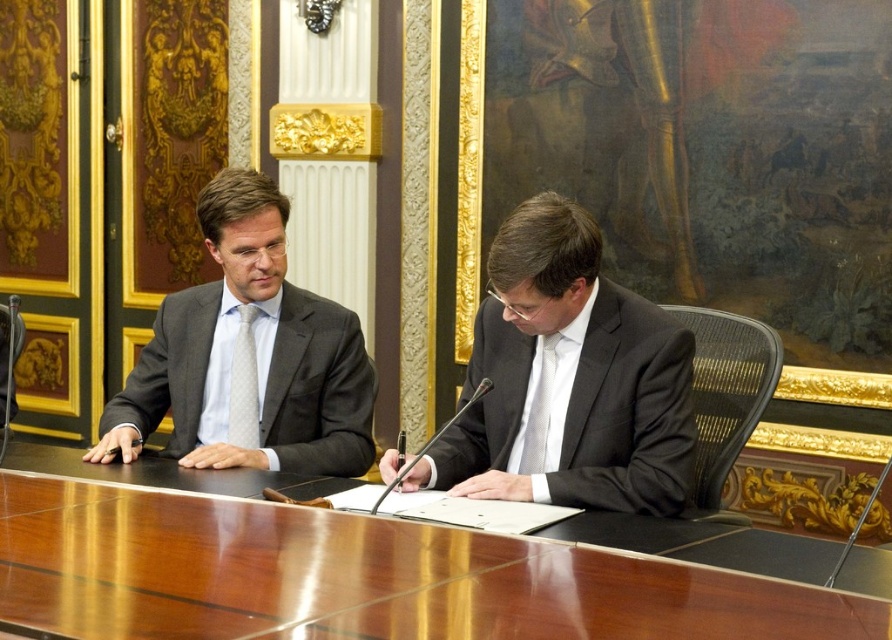
You are standing in front of the glossy wood table at center and want to hand a document to the person wearing the matte gray suit at left. Which direction should you move to reach them?

The glossy wood table at center is to the right of the matte gray suit at left, so you should move to your left to reach the person wearing the matte gray suit at left.